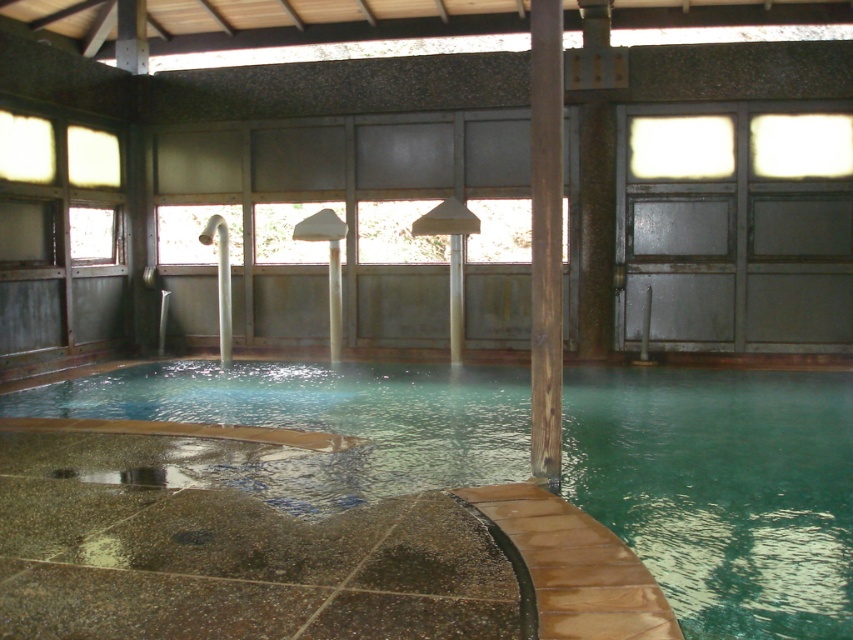
You are a visitor at the onsen and want to know if the green polished stone swimming pool at center is wider than the brown wood pillar at center. Can you confirm this?

The green polished stone swimming pool at center is wider than the brown wood pillar at center.

You are a guest at the onsen and want to enter the green polished stone swimming pool at center. However, there is a brown wood pillar at center in your way. Can you walk around the pillar to reach the pool?

The green polished stone swimming pool at center is located below brown wood pillar at center, which means the pillar is directly above the pool. You cannot walk around the pillar to reach the pool because it is positioned over the pool area.